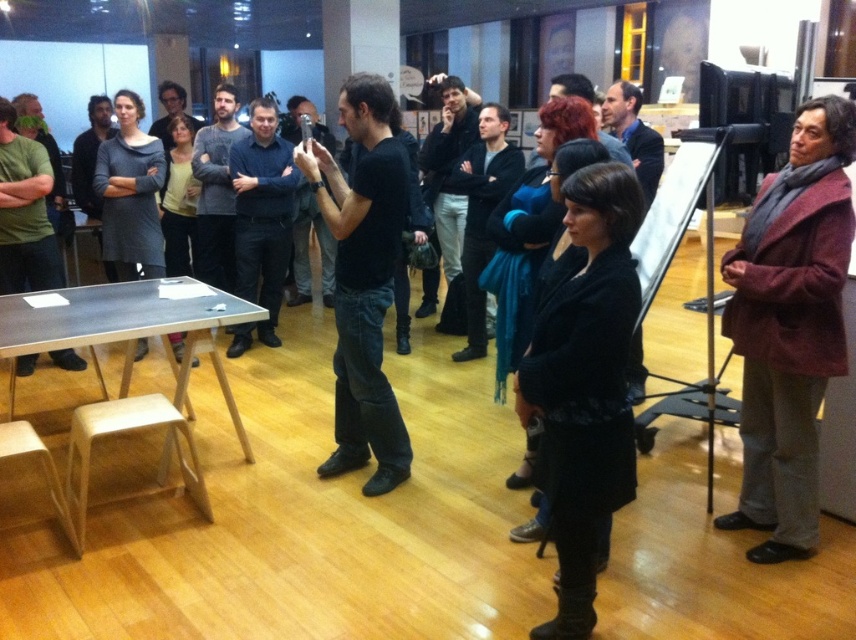
Question: Which object is the farthest from the black matte coat at center?

Choices:
 (A) black matte shirt at center
 (B) light brown wooden stool at lower left
 (C) matte black table at left
 (D) maroon woolen coat at right

Answer: (C)

Question: Does maroon woolen coat at right appear over light brown wooden stool at lower left?

Choices:
 (A) no
 (B) yes

Answer: (B)

Question: Is black matte shirt at center further to camera compared to wooden stool at lower left?

Choices:
 (A) no
 (B) yes

Answer: (B)

Question: Among these objects, which one is farthest from the camera?

Choices:
 (A) matte black table at left
 (B) maroon woolen coat at right
 (C) wooden stool at lower left

Answer: (A)

Question: Does matte black table at left appear under wooden stool at lower left?

Choices:
 (A) yes
 (B) no

Answer: (B)

Question: Among these objects, which one is farthest from the camera?

Choices:
 (A) matte black table at left
 (B) maroon woolen coat at right
 (C) wooden stool at lower left

Answer: (A)